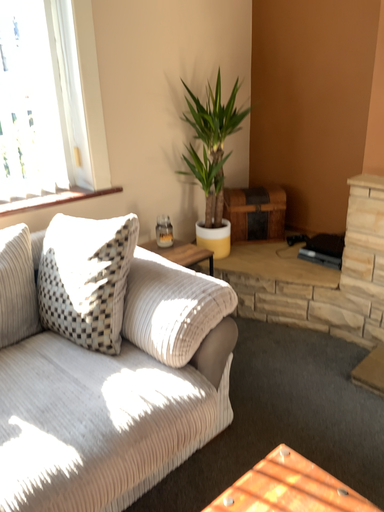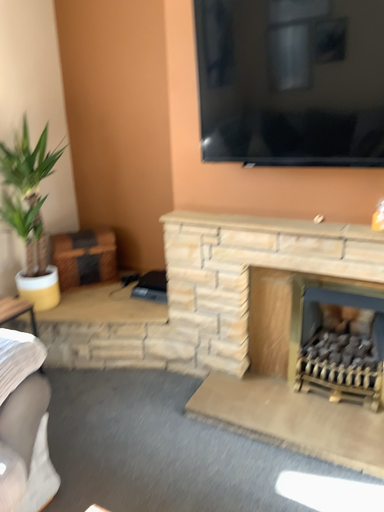
Question: How did the camera likely rotate when shooting the video?

Choices:
 (A) rotated upward
 (B) rotated downward

Answer: (A)